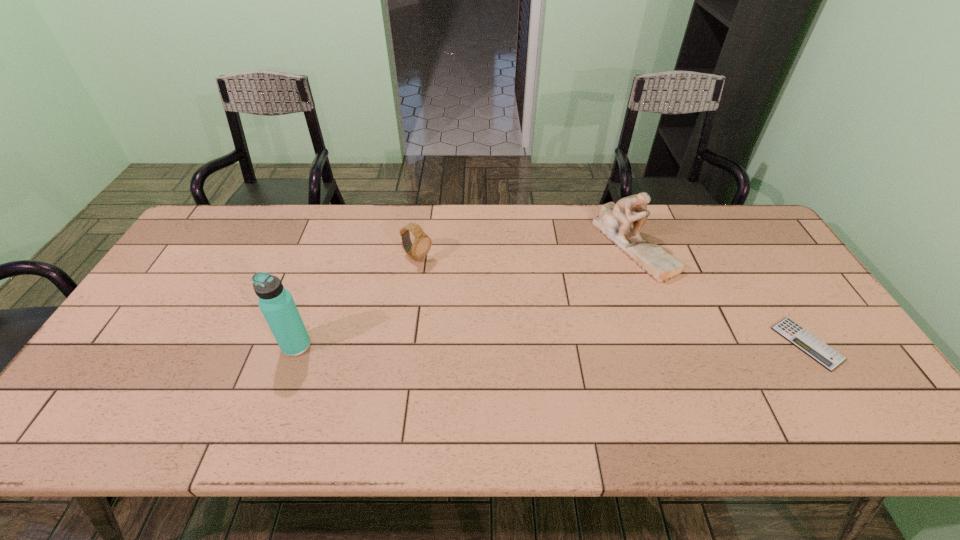
You are a GUI agent. You are given a task and a screenshot of the screen. Output one action in this format:
    pyautogui.click(x=<x>, y=<y>)
    Task: Click on the object at the near right corner
    The image size is (960, 540).
    Given the screenshot: What is the action you would take?
    pyautogui.click(x=822, y=353)

What are the coordinates of `blank area at the far edge` in the screenshot? It's located at (575, 234).

This screenshot has height=540, width=960. Identify the location of blank space at the near edge of the desktop. click(544, 389).

Locate an element on the screen. free region at the left edge of the desktop is located at coordinates (165, 364).

The height and width of the screenshot is (540, 960). In the image, there is a desktop. In order to click on vacant space at the right edge in this screenshot , I will do `click(808, 307)`.

In the image, there is a desktop. At what (x,y) coordinates should I click in order to perform the action: click on vacant region at the far left corner. Please return your answer as a coordinate pair (x, y). Looking at the image, I should click on (235, 215).

The width and height of the screenshot is (960, 540). In the image, there is a desktop. In order to click on free region at the far right corner in this screenshot , I will do `click(753, 232)`.

Find the location of a particular element. vacant space at the near right corner of the desktop is located at coordinates (875, 388).

At what (x,y) coordinates should I click in order to perform the action: click on vacant space in between the figurine and the calculator. Please return your answer as a coordinate pair (x, y). Image resolution: width=960 pixels, height=540 pixels. Looking at the image, I should click on (720, 294).

Image resolution: width=960 pixels, height=540 pixels. I want to click on free spot between the third object from right to left and the figurine, so click(x=525, y=252).